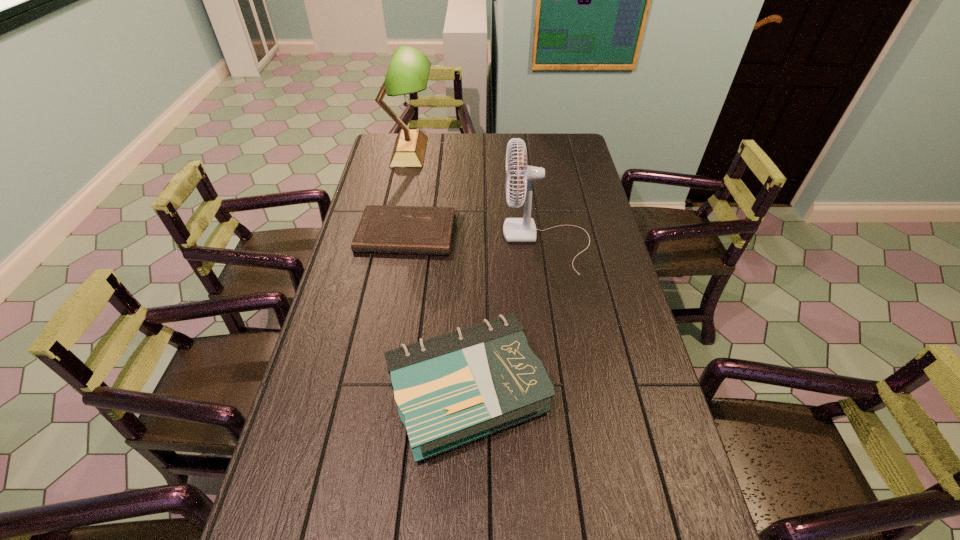
Locate an element on the screen. blank area located on the back of the nearer paperback book is located at coordinates (469, 261).

Locate an element on the screen. This screenshot has width=960, height=540. vacant area situated on the front of the shortest object is located at coordinates (388, 336).

In order to click on object that is at the far edge in this screenshot , I will do `click(408, 72)`.

This screenshot has height=540, width=960. In order to click on table lamp located in the left edge section of the desktop in this screenshot , I will do (x=408, y=72).

This screenshot has height=540, width=960. I want to click on paperback book present at the left edge, so click(382, 229).

Identify the location of object at the right edge. (523, 229).

This screenshot has width=960, height=540. I want to click on object positioned at the far left corner, so click(408, 72).

This screenshot has width=960, height=540. Identify the location of vacant position at the far edge of the desktop. (476, 143).

This screenshot has width=960, height=540. Find the location of `free space at the left edge of the desktop`. free space at the left edge of the desktop is located at coordinates (287, 523).

In the image, there is a desktop. Where is `vacant area at the right edge`? This screenshot has height=540, width=960. vacant area at the right edge is located at coordinates (565, 244).